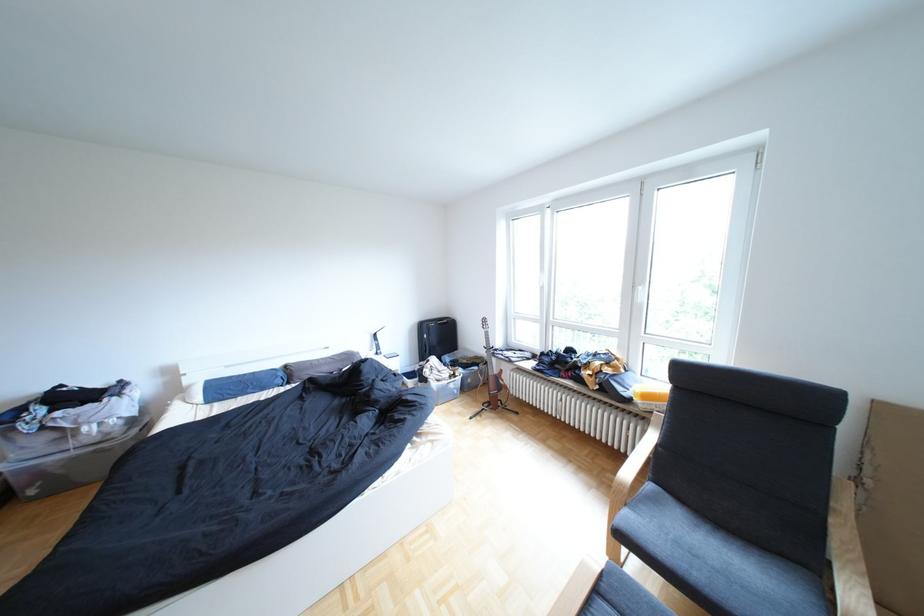
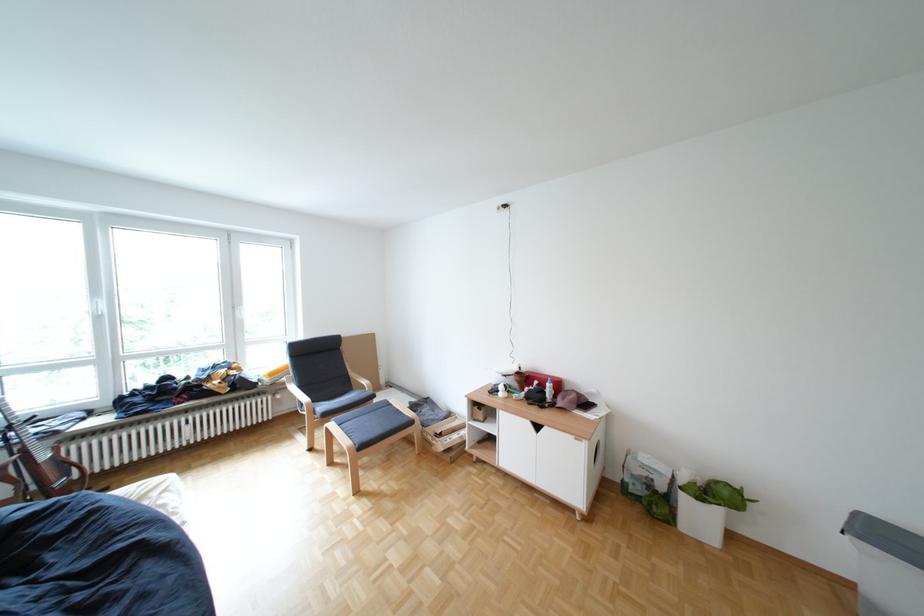
Locate, in the second image, the point that corresponds to pixel 662 397 in the first image.

(286, 374)